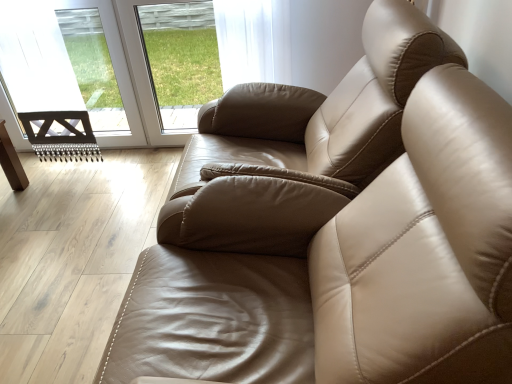
Question: Should I look upward or downward to see transparent glass door at upper left?

Choices:
 (A) up
 (B) down

Answer: (A)

Question: Is satin beige armchair at center positioned behind transparent glass door at upper left?

Choices:
 (A) yes
 (B) no

Answer: (B)

Question: Is satin beige armchair at center far from transparent glass door at upper left?

Choices:
 (A) no
 (B) yes

Answer: (B)

Question: Considering the relative sizes of satin beige armchair at center and transparent glass door at upper left in the image provided, is satin beige armchair at center thinner than transparent glass door at upper left?

Choices:
 (A) yes
 (B) no

Answer: (B)

Question: Does satin beige armchair at center have a lesser height compared to transparent glass door at upper left?

Choices:
 (A) no
 (B) yes

Answer: (A)

Question: Is satin beige armchair at center facing away from transparent glass door at upper left?

Choices:
 (A) yes
 (B) no

Answer: (B)

Question: Does satin beige armchair at center have a greater height compared to transparent glass door at upper left?

Choices:
 (A) yes
 (B) no

Answer: (A)

Question: Is transparent glass door at upper left turned away from transparent glass window at upper center?

Choices:
 (A) yes
 (B) no

Answer: (B)

Question: Is transparent glass door at upper left further to camera compared to transparent glass window at upper center?

Choices:
 (A) no
 (B) yes

Answer: (B)

Question: Can you confirm if transparent glass door at upper left is thinner than transparent glass window at upper center?

Choices:
 (A) yes
 (B) no

Answer: (B)

Question: Could transparent glass window at upper center be considered to be inside transparent glass door at upper left?

Choices:
 (A) yes
 (B) no

Answer: (B)

Question: Does transparent glass door at upper left have a smaller size compared to transparent glass window at upper center?

Choices:
 (A) yes
 (B) no

Answer: (B)

Question: From a real-world perspective, is transparent glass door at upper left located higher than transparent glass window at upper center?

Choices:
 (A) yes
 (B) no

Answer: (A)

Question: Is satin beige armchair at center a part of transparent glass window at upper center?

Choices:
 (A) no
 (B) yes

Answer: (A)